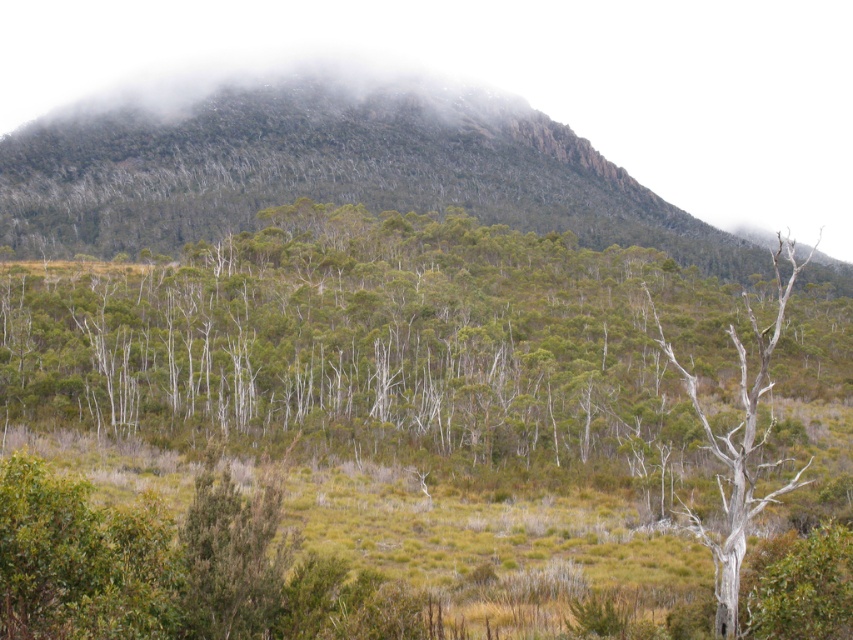
Question: Is green matte trees at center above green leafy forest at upper center?

Choices:
 (A) yes
 (B) no

Answer: (B)

Question: Which of the following is the closest to the observer?

Choices:
 (A) (763, 356)
 (B) (279, 326)

Answer: (A)

Question: Which of the following is the closest to the observer?

Choices:
 (A) green leafy forest at upper center
 (B) white bark birch tree at right
 (C) green matte trees at center

Answer: (B)

Question: Does green matte trees at center come in front of green leafy forest at upper center?

Choices:
 (A) no
 (B) yes

Answer: (B)

Question: Which of the following is the farthest from the observer?

Choices:
 (A) click(422, 316)
 (B) click(244, 170)
 (C) click(747, 486)

Answer: (B)

Question: Is green leafy forest at upper center to the left of white bark birch tree at right from the viewer's perspective?

Choices:
 (A) no
 (B) yes

Answer: (B)